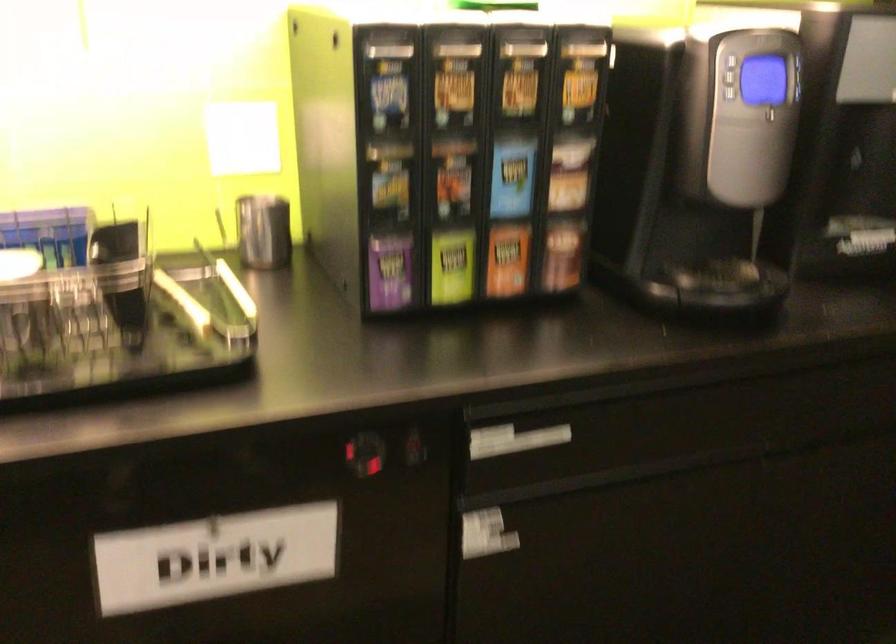
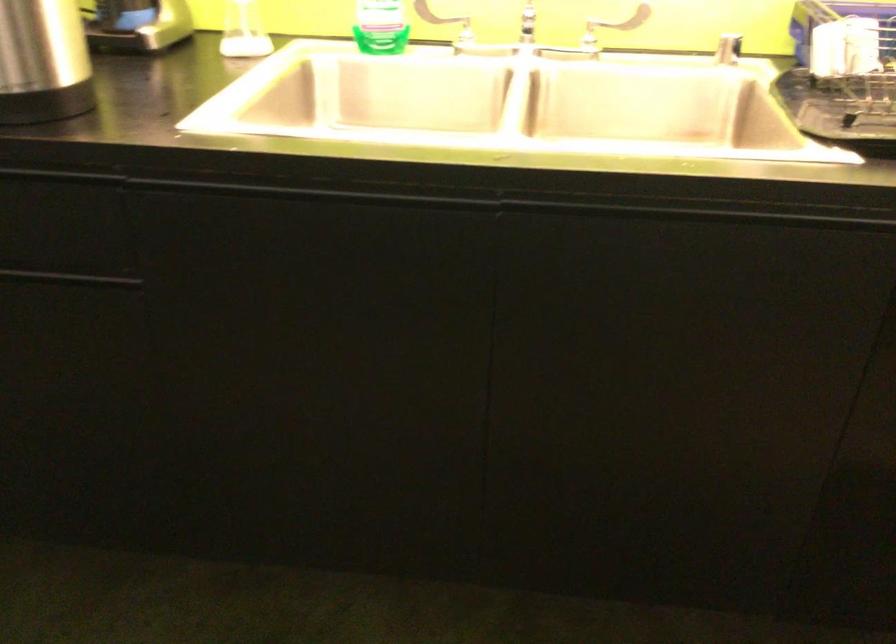
Question: The camera is either moving clockwise (left) or counter-clockwise (right) around the object. The first image is from the beginning of the video and the second image is from the end. Is the camera moving left or right when shooting the video?

Choices:
 (A) Left
 (B) Right

Answer: (B)